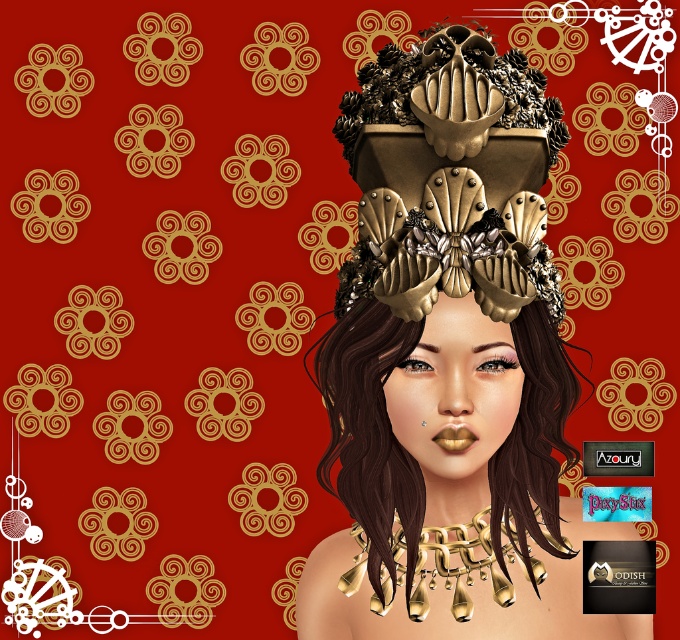
Question: Which point is closer to the camera?

Choices:
 (A) gold metallic necklace at lower center
 (B) shiny brown hair at center
 (C) gold metallic headdress at center

Answer: (C)

Question: Can you confirm if gold metallic headdress at center is bigger than gold metallic necklace at lower center?

Choices:
 (A) yes
 (B) no

Answer: (A)

Question: Does gold metallic headdress at center come in front of gold metallic necklace at lower center?

Choices:
 (A) yes
 (B) no

Answer: (A)

Question: Where is shiny brown hair at center located in relation to gold metallic headdress at center in the image?

Choices:
 (A) below
 (B) above

Answer: (A)

Question: Which point is closer to the camera taking this photo?

Choices:
 (A) (510, 493)
 (B) (340, 308)

Answer: (B)

Question: Which point appears closest to the camera in this image?

Choices:
 (A) (486, 305)
 (B) (360, 349)
 (C) (460, 534)

Answer: (A)